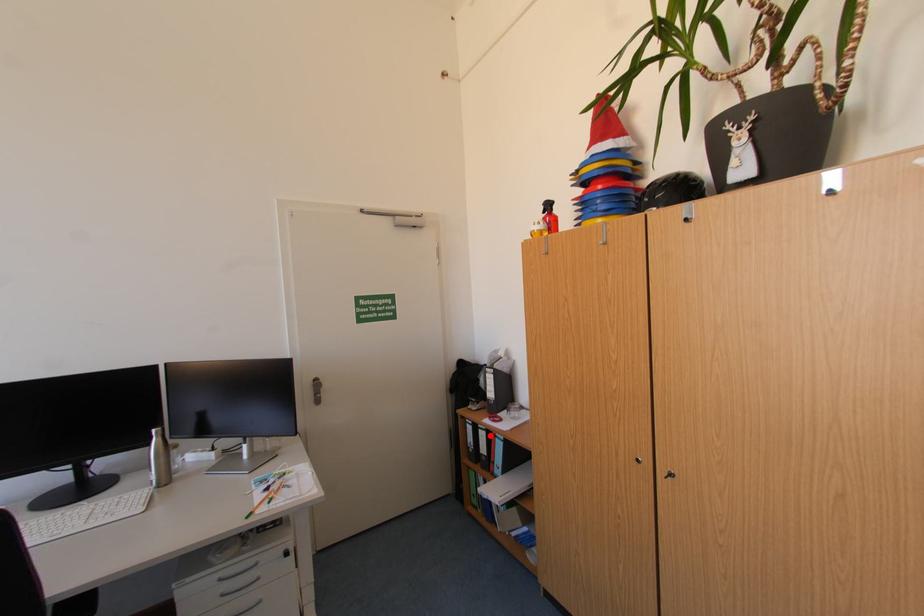
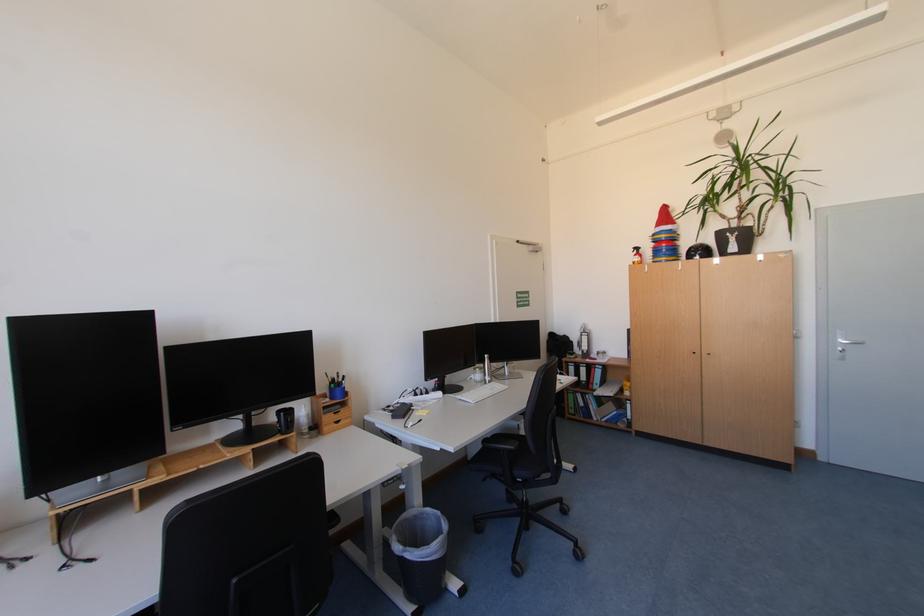
The point at the highlighted location is marked in the first image. Where is the corresponding point in the second image?

(590, 371)